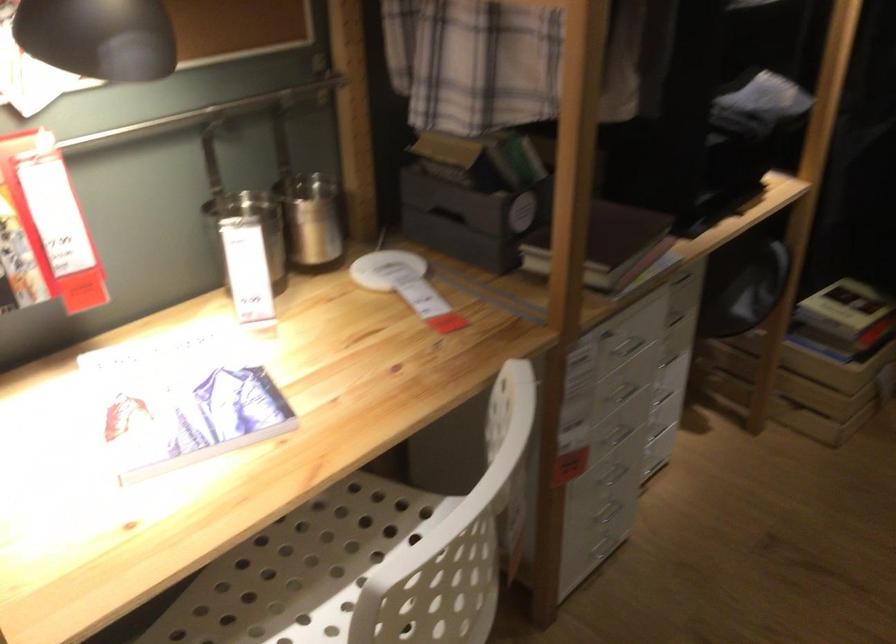
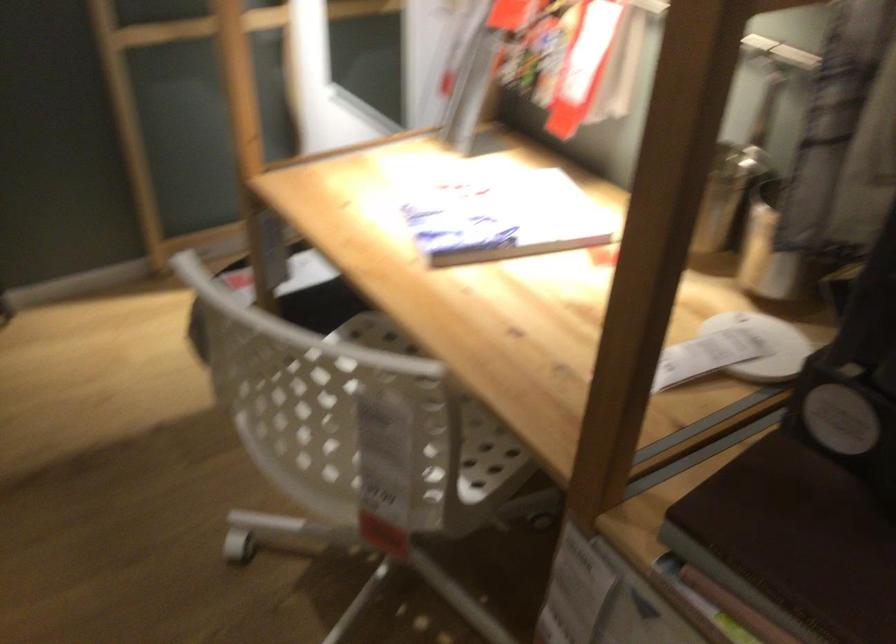
The point at (586,116) is marked in the first image. Where is the corresponding point in the second image?

(771, 252)